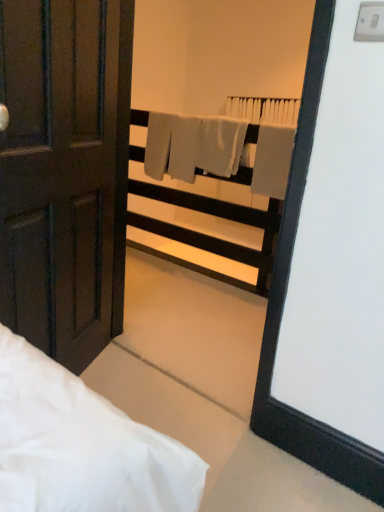
Question: Considering the positions of white plastic balustrade at upper center and matte dark brown door at left in the image, is white plastic balustrade at upper center bigger or smaller than matte dark brown door at left?

Choices:
 (A) big
 (B) small

Answer: (A)

Question: Is white plastic balustrade at upper center in front of or behind matte dark brown door at left in the image?

Choices:
 (A) behind
 (B) front

Answer: (A)

Question: Based on their relative distances, which object is nearer to the white plastic balustrade at upper center?

Choices:
 (A) matte dark brown door at left
 (B) gray matte towel at center

Answer: (B)

Question: Estimate the real-world distances between objects in this image. Which object is closer to the matte dark brown door at left?

Choices:
 (A) gray matte towel at center
 (B) white plastic balustrade at upper center

Answer: (A)